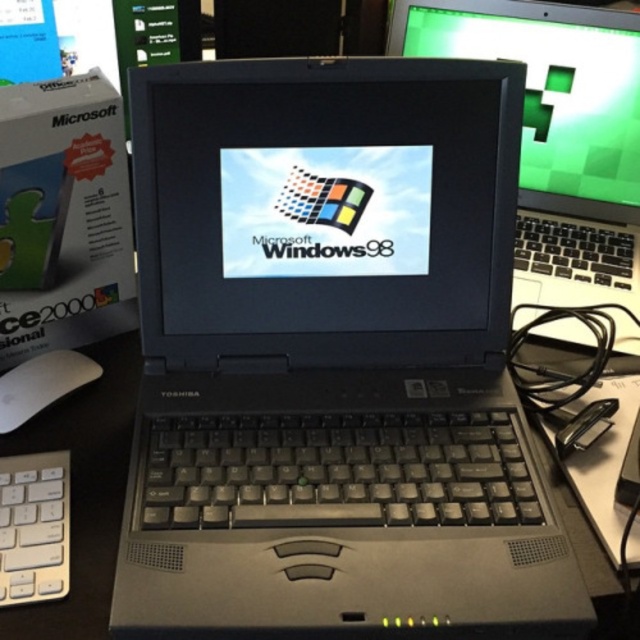
Question: Among these objects, which one is nearest to the camera?

Choices:
 (A) white plastic keyboard at lower left
 (B) black plastic table at center
 (C) white matte mouse at lower left

Answer: (B)

Question: Which is nearer to the white plastic keyboard at lower left?

Choices:
 (A) white matte mouse at lower left
 (B) slate gray plastic laptop at center
 (C) matte black monitor at upper right

Answer: (A)

Question: Which point is closer to the camera?

Choices:
 (A) (266, 516)
 (B) (608, 77)
 (C) (64, 632)
 (D) (54, 394)

Answer: (C)

Question: Can you confirm if slate gray plastic laptop at center is smaller than matte black monitor at upper right?

Choices:
 (A) yes
 (B) no

Answer: (B)

Question: Is black plastic table at center in front of white plastic keyboard at lower left?

Choices:
 (A) yes
 (B) no

Answer: (A)

Question: Observing the image, what is the correct spatial positioning of slate gray plastic laptop at center in reference to black plastic table at center?

Choices:
 (A) below
 (B) above

Answer: (B)